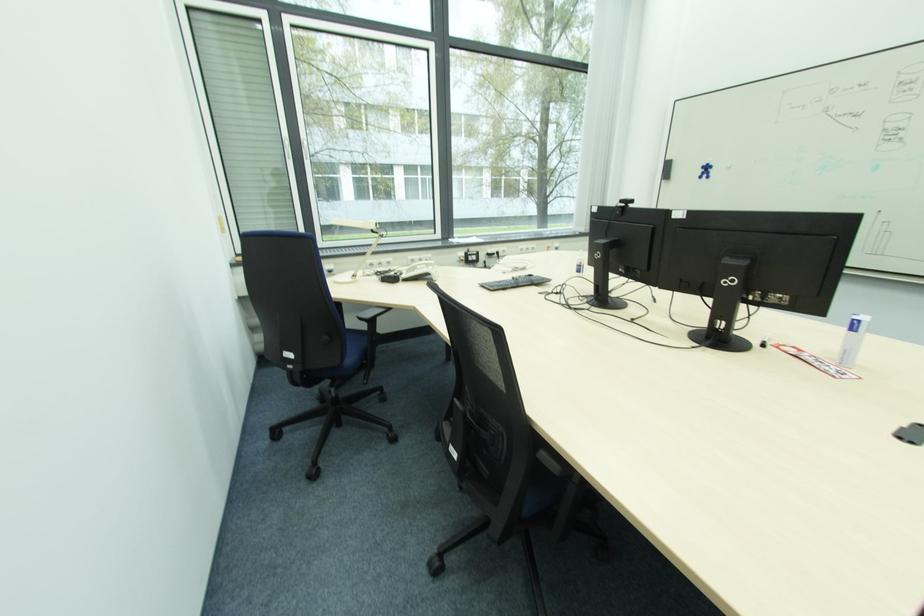
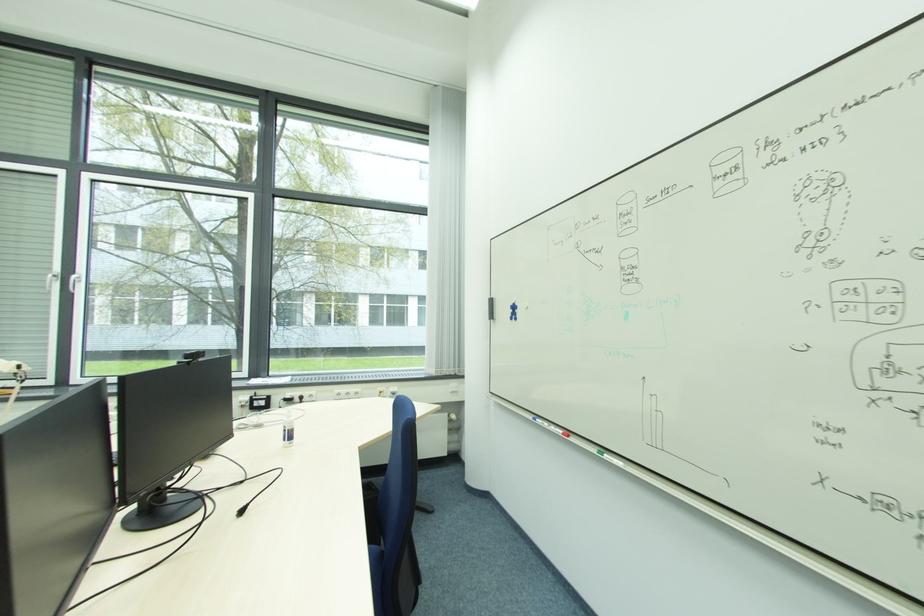
Find the pixel in the second image that matches [707,172] in the first image.

(515, 313)